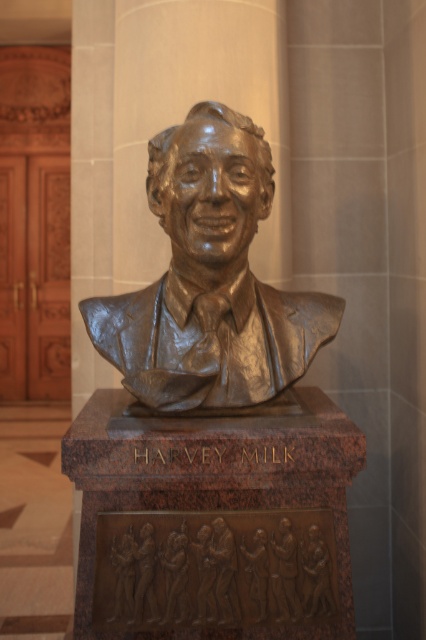
Question: Among these points, which one is nearest to the camera?

Choices:
 (A) (164, 368)
 (B) (137, 566)

Answer: (B)

Question: Which point appears farthest from the camera in this image?

Choices:
 (A) (204, 301)
 (B) (141, 598)

Answer: (A)

Question: Is shiny bronze bust at center above bronze relief figures at center?

Choices:
 (A) no
 (B) yes

Answer: (B)

Question: Does shiny bronze bust at center appear on the right side of bronze relief figures at center?

Choices:
 (A) yes
 (B) no

Answer: (A)

Question: Is shiny bronze bust at center positioned in front of bronze relief figures at center?

Choices:
 (A) no
 (B) yes

Answer: (B)